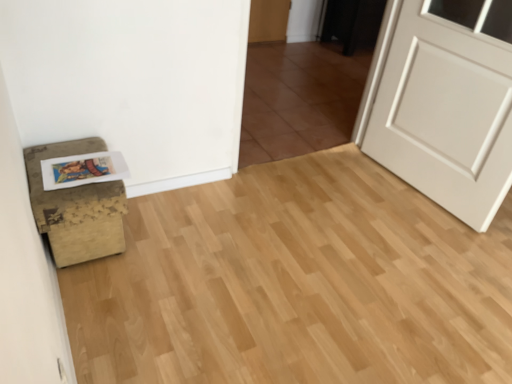
Locate an element on the screen. The height and width of the screenshot is (384, 512). free area below white matte door at right (from a real-world perspective) is located at coordinates (414, 193).